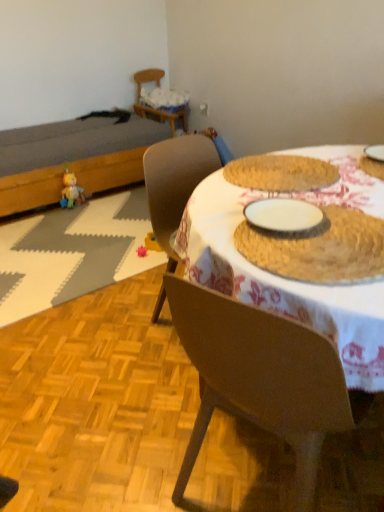
Where is `empty space that is to the right of plush yellow duck at left, the 1th toy when ordered from back to front`? Image resolution: width=384 pixels, height=512 pixels. empty space that is to the right of plush yellow duck at left, the 1th toy when ordered from back to front is located at coordinates pos(101,206).